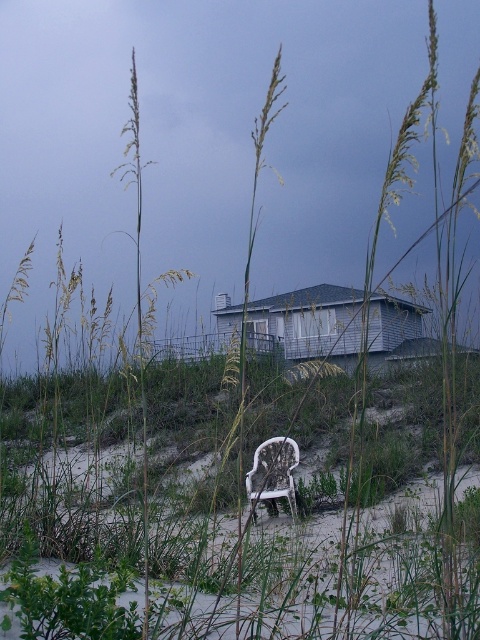
Question: Which object appears closest to the camera in this image?

Choices:
 (A) white wood house at center
 (B) green grass at center

Answer: (B)

Question: Is green grass at center smaller than white plastic chair at lower center?

Choices:
 (A) yes
 (B) no

Answer: (B)

Question: Estimate the real-world distances between objects in this image. Which object is closer to the green grass at center?

Choices:
 (A) white wood house at center
 (B) white plastic chair at lower center

Answer: (B)

Question: Can you confirm if green grass at center is bigger than white wood house at center?

Choices:
 (A) yes
 (B) no

Answer: (A)

Question: Estimate the real-world distances between objects in this image. Which object is farther from the green grass at center?

Choices:
 (A) white wood house at center
 (B) white plastic chair at lower center

Answer: (A)

Question: Can you confirm if green grass at center is positioned to the left of white wood house at center?

Choices:
 (A) no
 (B) yes

Answer: (B)